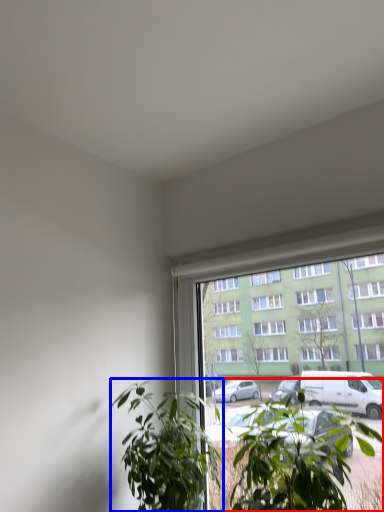
Question: Which of the following is the closest to the observer, houseplant (highlighted by a red box) or houseplant (highlighted by a blue box)?

Choices:
 (A) houseplant
 (B) houseplant

Answer: (A)